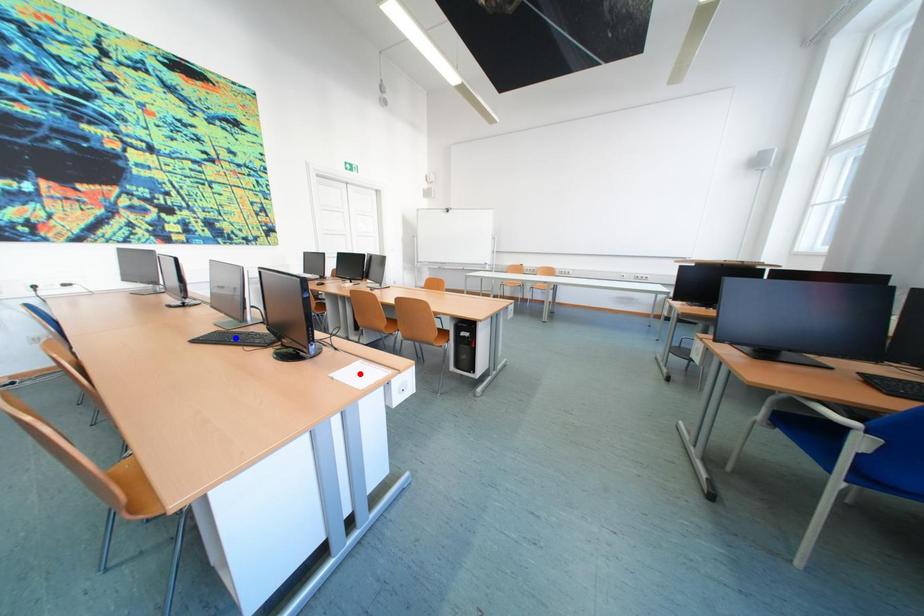
Question: Two points are marked on the image. Which point is closer to the camera?

Choices:
 (A) Blue point is closer.
 (B) Red point is closer.

Answer: (B)